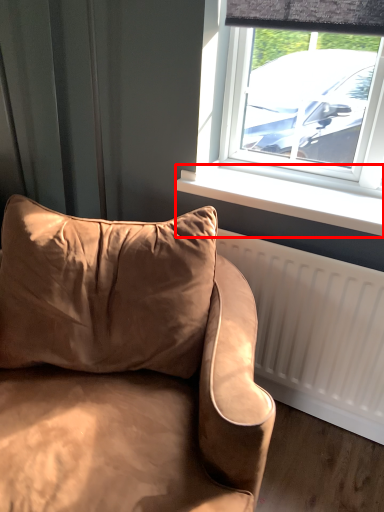
Question: Where is window sill (annotated by the red box) located in relation to studio couch in the image?

Choices:
 (A) right
 (B) left

Answer: (A)